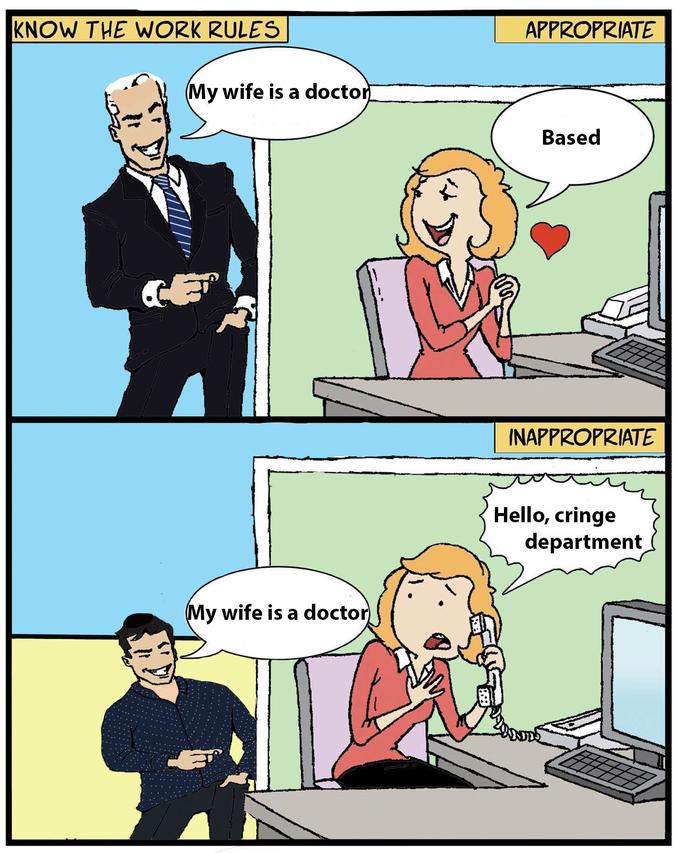
You are a GUI agent. You are given a task and a screenshot of the screen. Output one action in this format:
    pyautogui.click(x=<x>, y=<y>)
    Task: Click on the desk top computer
    The image size is (680, 853).
    Given the screenshot: What is the action you would take?
    pyautogui.click(x=657, y=285), pyautogui.click(x=639, y=653)